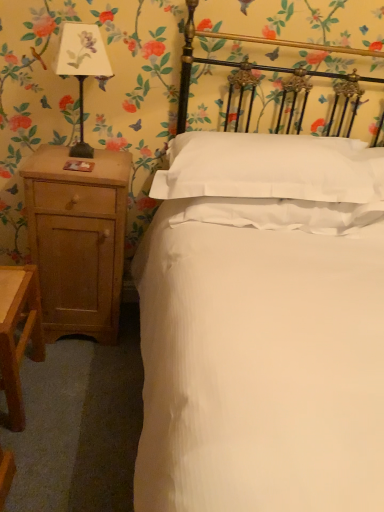
Question: Is white smooth pillow at center at the back of light brown wood nightstand at left?

Choices:
 (A) no
 (B) yes

Answer: (A)

Question: Is light brown wood nightstand at left oriented towards white smooth pillow at center?

Choices:
 (A) no
 (B) yes

Answer: (A)

Question: Is light brown wood nightstand at left placed right next to white smooth pillow at center?

Choices:
 (A) yes
 (B) no

Answer: (B)

Question: From a real-world perspective, is light brown wood nightstand at left on white smooth pillow at center?

Choices:
 (A) no
 (B) yes

Answer: (A)

Question: From the image's perspective, is light brown wood nightstand at left above white smooth pillow at center?

Choices:
 (A) yes
 (B) no

Answer: (B)

Question: Is light brown wood nightstand at left further to the viewer compared to white smooth pillow at center?

Choices:
 (A) no
 (B) yes

Answer: (B)

Question: From the image's perspective, would you say white smooth pillow at center is shown under light brown wood nightstand at left?

Choices:
 (A) no
 (B) yes

Answer: (A)

Question: Is light brown wood nightstand at left located within white smooth pillow at center?

Choices:
 (A) no
 (B) yes

Answer: (A)

Question: Would you consider white smooth pillow at center to be distant from light brown wood nightstand at left?

Choices:
 (A) no
 (B) yes

Answer: (A)

Question: Can you confirm if white smooth pillow at center is shorter than light brown wood nightstand at left?

Choices:
 (A) yes
 (B) no

Answer: (A)

Question: Does white smooth pillow at center have a larger size compared to light brown wood nightstand at left?

Choices:
 (A) yes
 (B) no

Answer: (A)

Question: Considering the relative sizes of white smooth pillow at center and light brown wood nightstand at left in the image provided, is white smooth pillow at center wider than light brown wood nightstand at left?

Choices:
 (A) no
 (B) yes

Answer: (B)

Question: Is matte black lampshade at left shorter than white smooth pillow at center?

Choices:
 (A) yes
 (B) no

Answer: (B)